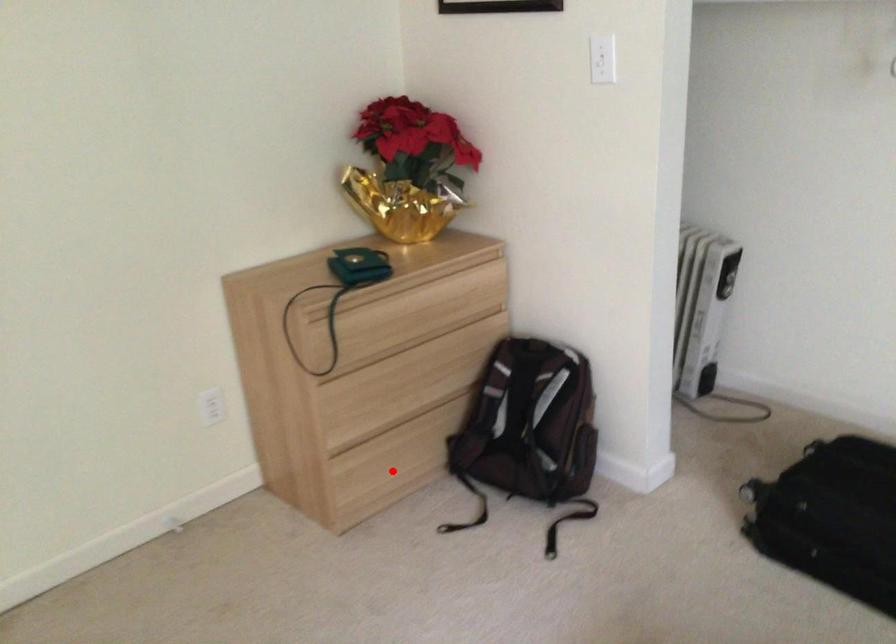
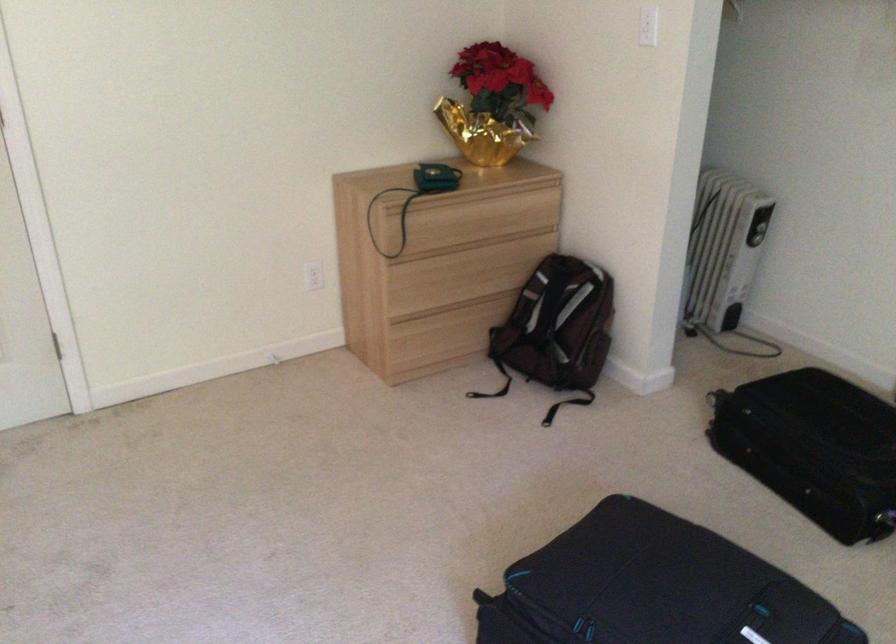
Question: I am providing you with two images of the same scene from different viewpoints. Given a red point in image1, look at the same physical point in image2. Is it:

Choices:
 (A) Closer to the viewpoint
 (B) Farther from the viewpoint

Answer: (B)